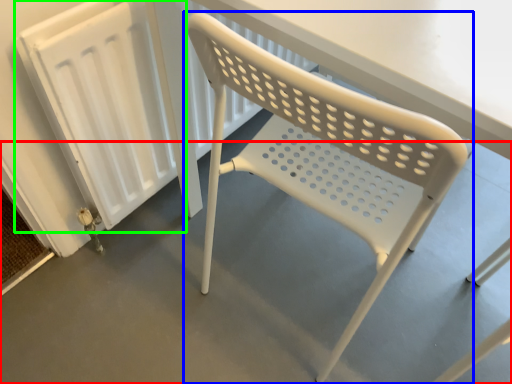
Question: Considering the real-world distances, which object is closest to concrete (highlighted by a red box)? chair (highlighted by a blue box) or radiator (highlighted by a green box).

Choices:
 (A) chair
 (B) radiator

Answer: (A)